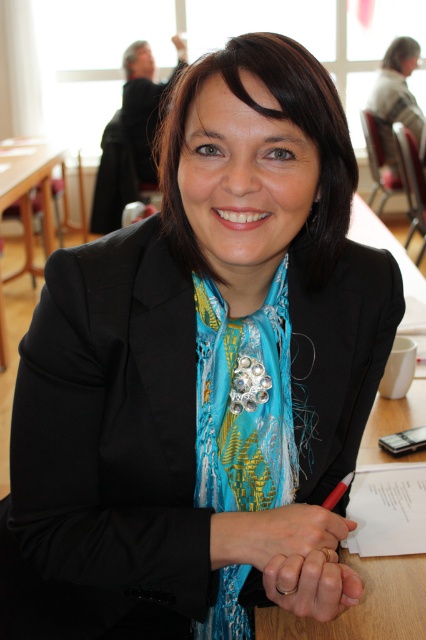
Question: Does shiny blue scarf at center have a larger size compared to metallic red pen at center?

Choices:
 (A) no
 (B) yes

Answer: (B)

Question: Which point is farther to the camera?

Choices:
 (A) wooden table at left
 (B) shiny blue scarf at center

Answer: (A)

Question: Which object is farther from the camera taking this photo?

Choices:
 (A) metallic red pen at center
 (B) shiny blue scarf at center
 (C) wooden table at left

Answer: (C)

Question: Considering the relative positions of shiny blue scarf at center and metallic red pen at center in the image provided, where is shiny blue scarf at center located with respect to metallic red pen at center?

Choices:
 (A) right
 (B) left

Answer: (B)

Question: Which point is closer to the camera taking this photo?

Choices:
 (A) (342, 484)
 (B) (276, 502)
 (C) (2, 173)

Answer: (A)

Question: In this image, where is wooden table at left located relative to metallic red pen at center?

Choices:
 (A) left
 (B) right

Answer: (A)